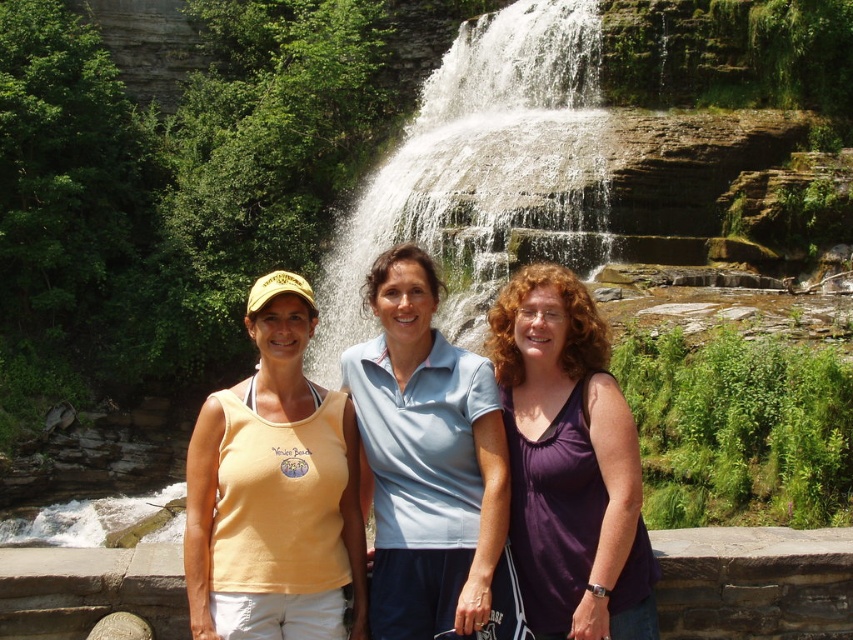
Which is more to the left, light blue cotton polo shirt at center or purple matte tank top at center?

light blue cotton polo shirt at center

Is light blue cotton polo shirt at center in front of purple matte tank top at center?

No.

Is point (447, 552) positioned before point (566, 394)?

Yes, it is.

I want to click on light blue cotton polo shirt at center, so click(x=428, y=464).

The image size is (853, 640). I want to click on white textured water at center, so click(x=479, y=170).

Image resolution: width=853 pixels, height=640 pixels. I want to click on white textured water at center, so click(x=479, y=170).

Does point (212, 602) come behind point (462, 516)?

That is False.

Which is below, yellow sleeveless shirt at center or light blue cotton polo shirt at center?

Positioned lower is light blue cotton polo shirt at center.

At what (x,y) coordinates should I click in order to perform the action: click on yellow sleeveless shirt at center. Please return your answer as a coordinate pair (x, y). Looking at the image, I should click on (274, 490).